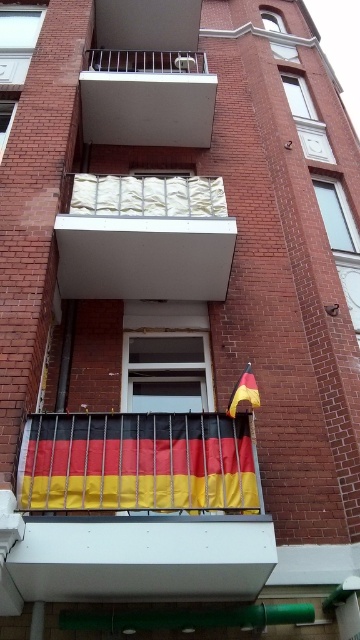
Locate an element on the screen. white glass window at upper left is located at coordinates (18, 40).

Looking at this image, who is higher up, white glass window at upper left or clear glass window at upper center?

white glass window at upper left is above.

Who is more distant from viewer, (x=0, y=77) or (x=295, y=86)?

Positioned behind is point (x=295, y=86).

What are the coordinates of `white glass window at upper left` in the screenshot? It's located at (18, 40).

Between white fabric curtains at upper center and white glossy window at upper center, which one appears on the left side from the viewer's perspective?

white fabric curtains at upper center

Is white fabric curtains at upper center below white glossy window at upper center?

Yes, white fabric curtains at upper center is below white glossy window at upper center.

The width and height of the screenshot is (360, 640). What do you see at coordinates (147, 195) in the screenshot? I see `white fabric curtains at upper center` at bounding box center [147, 195].

You are a GUI agent. You are given a task and a screenshot of the screen. Output one action in this format:
    pyautogui.click(x=<x>, y=<y>)
    Task: Click on the white fabric curtains at upper center
    
    Given the screenshot: What is the action you would take?
    pyautogui.click(x=147, y=195)

Who is shorter, white matte balcony at center or transparent glass window at upper left?

With less height is transparent glass window at upper left.

Does point (227, 268) come in front of point (3, 108)?

Yes, point (227, 268) is closer to viewer.

You are a GUI agent. You are given a task and a screenshot of the screen. Output one action in this format:
    pyautogui.click(x=<x>, y=<y>)
    Task: Click on the white matte balcony at center
    Image resolution: width=360 pixels, height=640 pixels.
    Given the screenshot: What is the action you would take?
    pyautogui.click(x=145, y=237)